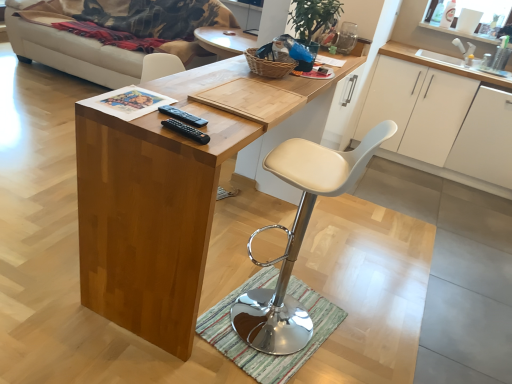
Locate an element on the screen. Image resolution: width=512 pixels, height=384 pixels. vacant space that is to the left of black plastic remote at center is located at coordinates (127, 108).